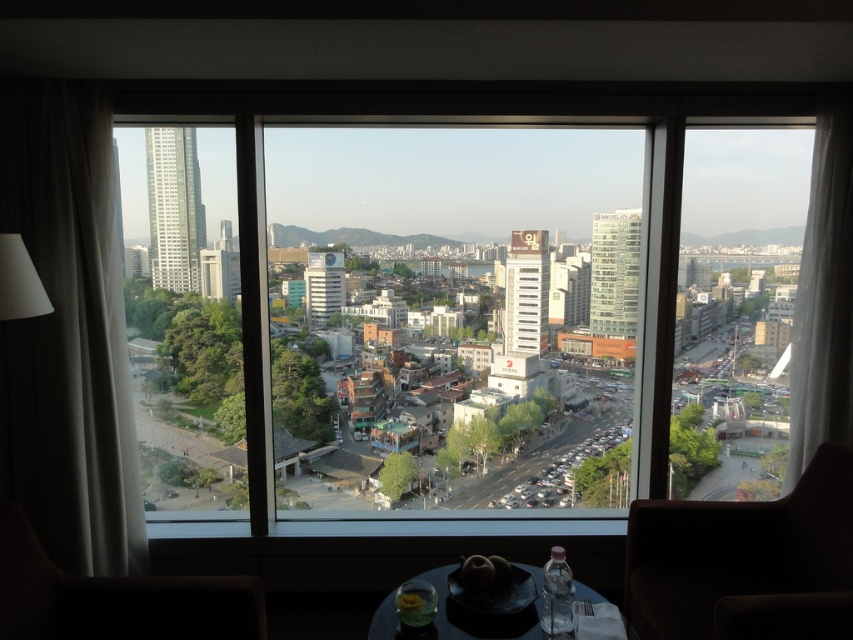
Question: Can you confirm if white glass skyscraper at left is smaller than transparent glass building at right?

Choices:
 (A) no
 (B) yes

Answer: (A)

Question: Is dark brown leather armchair at lower left further to camera compared to matte black table at lower center?

Choices:
 (A) yes
 (B) no

Answer: (B)

Question: Based on their relative distances, which object is nearer to the white glass skyscraper at left?

Choices:
 (A) brown leather armchair at lower right
 (B) matte black table at lower center
 (C) transparent glass building at right
 (D) white glass building at center

Answer: (D)

Question: Is brown leather armchair at lower right to the right of transparent glass building at right from the viewer's perspective?

Choices:
 (A) yes
 (B) no

Answer: (B)

Question: Which point is farther to the camera?

Choices:
 (A) (527, 330)
 (B) (190, 275)
 (C) (840, 497)

Answer: (B)

Question: Which object appears closest to the camera in this image?

Choices:
 (A) transparent glass building at right
 (B) brown leather armchair at lower right
 (C) dark brown leather armchair at lower left

Answer: (B)